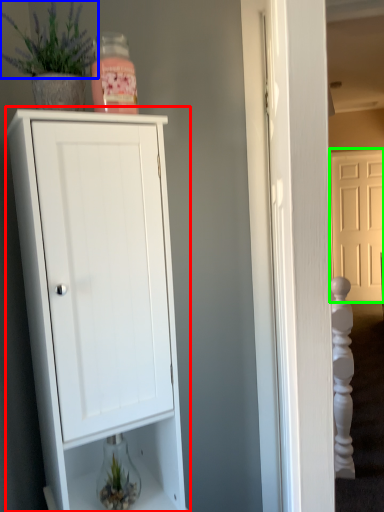
Question: Which object is positioned closest to cupboard (highlighted by a red box)? Select from plant (highlighted by a blue box) and door (highlighted by a green box).

Choices:
 (A) plant
 (B) door

Answer: (A)